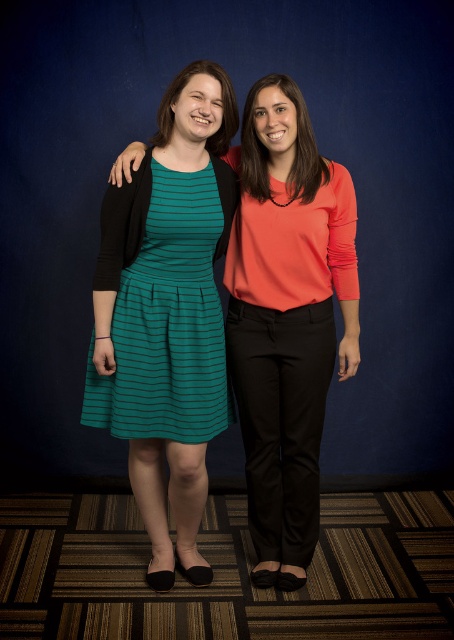
Question: Can you confirm if teal striped dress at center is bigger than matte orange blouse at center?

Choices:
 (A) yes
 (B) no

Answer: (A)

Question: Which is farther from the teal striped dress at center?

Choices:
 (A) matte coral blouse at center
 (B) matte orange blouse at center

Answer: (B)

Question: Is matte coral blouse at center positioned behind matte orange blouse at center?

Choices:
 (A) no
 (B) yes

Answer: (B)

Question: Which object is the farthest from the matte orange blouse at center?

Choices:
 (A) teal striped dress at center
 (B) matte coral blouse at center

Answer: (A)

Question: Where is matte coral blouse at center located in relation to teal striped dress at center in the image?

Choices:
 (A) above
 (B) below

Answer: (B)

Question: Which point is farther to the camera?

Choices:
 (A) (329, 177)
 (B) (261, 468)
 (C) (112, 435)

Answer: (C)